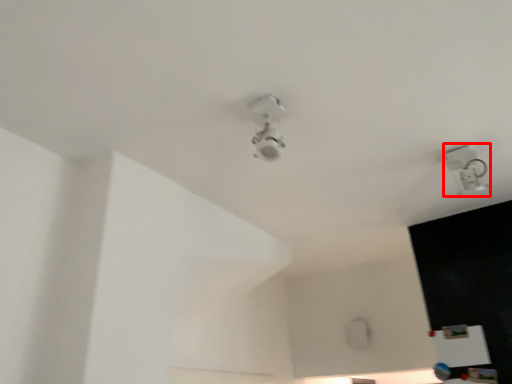
Question: From the image's perspective, where is lamp (annotated by the red box) located in relation to lamp in the image?

Choices:
 (A) above
 (B) below

Answer: (B)